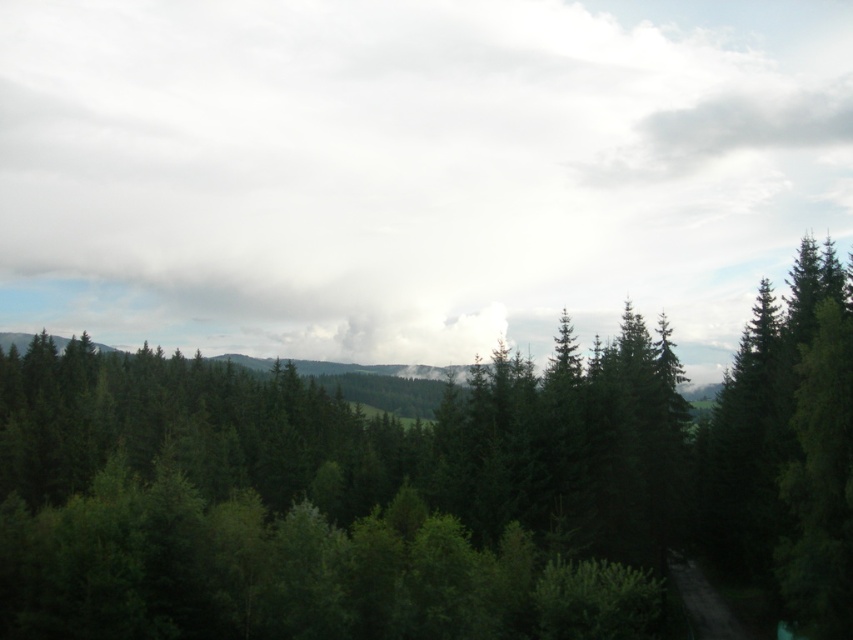
Is point (502, 58) positioned behind point (636, 445)?

Yes, point (502, 58) is behind point (636, 445).

Does white fluffy cloud at upper center appear over green matte tree at center?

Indeed, white fluffy cloud at upper center is positioned over green matte tree at center.

Is point (663, 157) behind point (3, 481)?

Yes, it is behind point (3, 481).

The height and width of the screenshot is (640, 853). I want to click on white fluffy cloud at upper center, so click(413, 170).